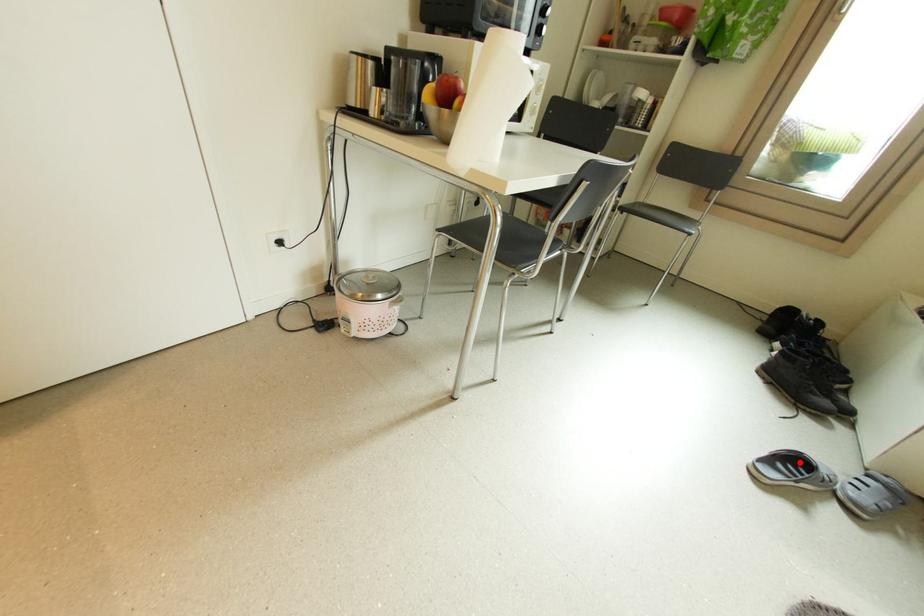
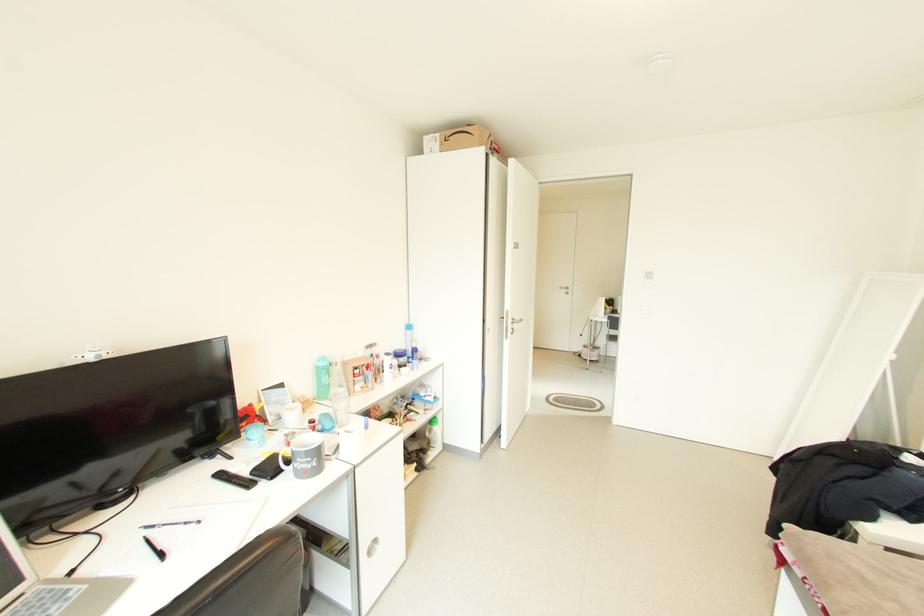
Question: I am providing you with two images of the same scene from different viewpoints. A red point is marked on the first image. Is the red point's position out of view in image 2?

Choices:
 (A) Yes
 (B) No

Answer: (A)